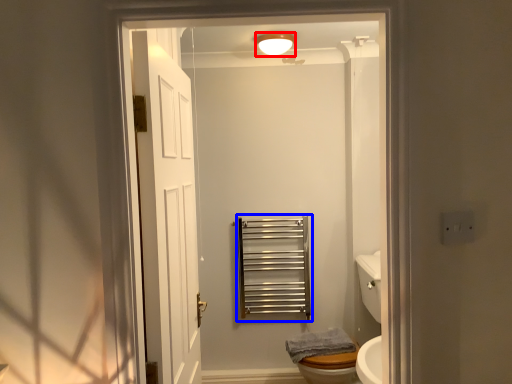
Question: Which object is closer to the camera taking this photo, light fixture (highlighted by a red box) or balustrade (highlighted by a blue box)?

Choices:
 (A) light fixture
 (B) balustrade

Answer: (A)